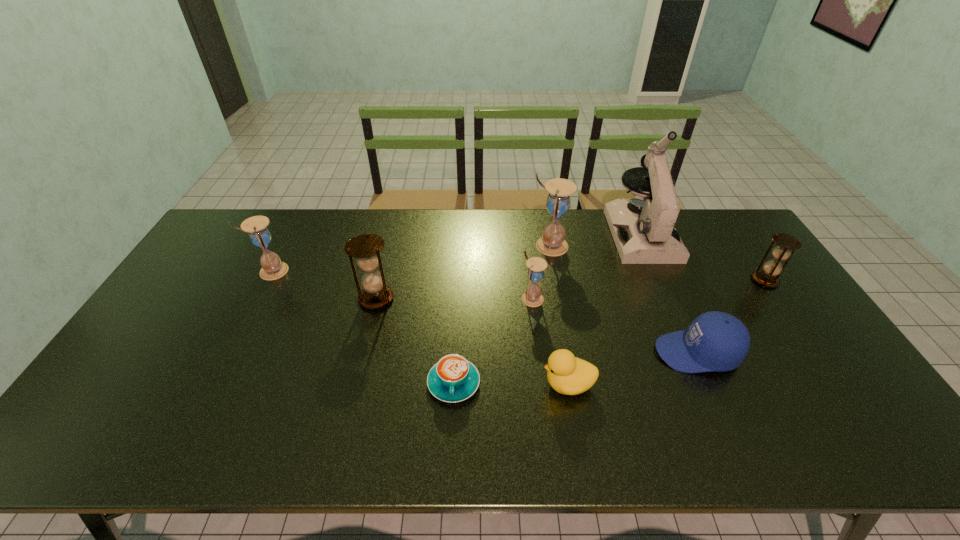
Locate which white hourglass ranks third in proximity to the bigger brown hourglass. Please provide its 2D coordinates. Your answer should be formatted as a tuple, i.e. [(x, y)], where the tuple contains the x and y coordinates of a point satisfying the conditions above.

[(552, 243)]

In order to click on vacant space that satisfies the following two spatial constraints: 1. at the eyepiece of the tallest object; 2. on the front-facing side of the duck in this screenshot , I will do `click(707, 384)`.

The image size is (960, 540). In order to click on free spot that satisfies the following two spatial constraints: 1. at the eyepiece of the microscope; 2. on the left side of the rightmost object in this screenshot , I will do `click(661, 280)`.

You are a GUI agent. You are given a task and a screenshot of the screen. Output one action in this format:
    pyautogui.click(x=<x>, y=<y>)
    Task: Click on the vacant space that satisfies the following two spatial constraints: 1. at the eyepiece of the tallest object; 2. on the front-facing side of the duck
    
    Given the screenshot: What is the action you would take?
    pyautogui.click(x=707, y=384)